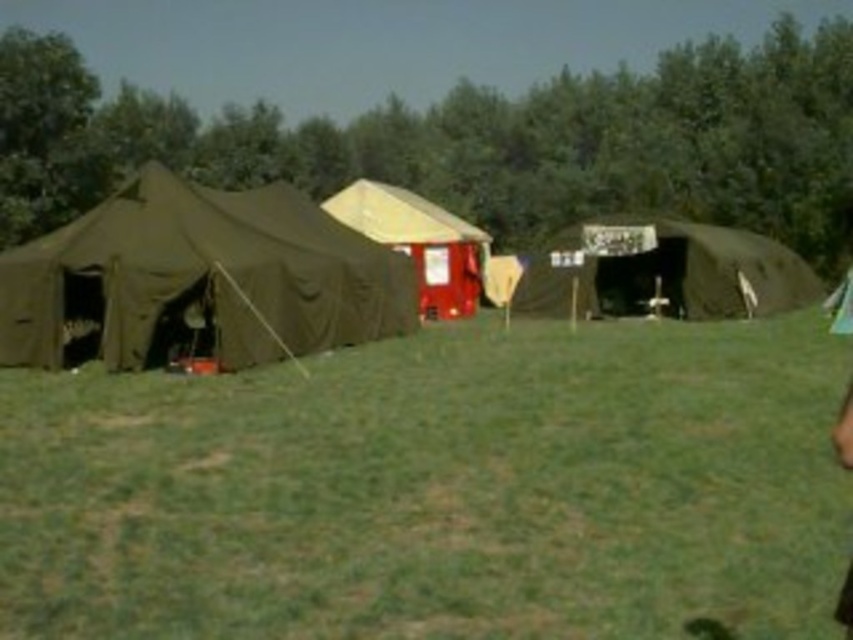
You are planning to set up a small garden in the green grass at center near the matte green tent at center. Considering the height of both, which one is shorter?

The green grass at center is shorter than the matte green tent at center.

You are a hiker who wants to set up a picnic blanket. You have a spot in mind between the green grass at center and the olive green canvas tent at left. Based on the scene, will the picnic blanket be placed closer to the tent or further away from it?

The green grass at center is in front of the olive green canvas tent at left, so placing the picnic blanket between them would position it closer to the tent.